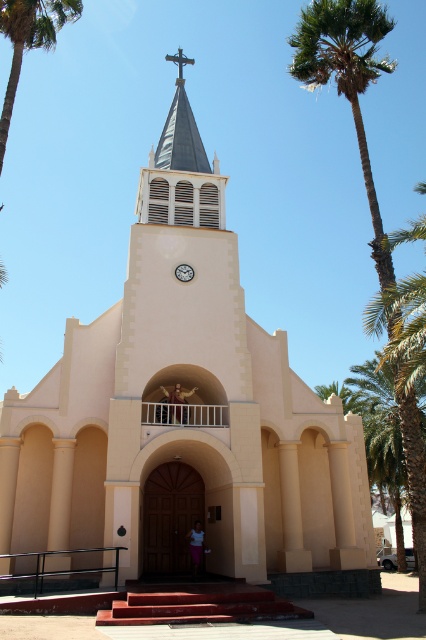
Who is shorter, green leafy palm tree at upper left or smooth beige statue at upper center?

With less height is smooth beige statue at upper center.

Does green leafy palm tree at upper left come behind smooth beige statue at upper center?

No, green leafy palm tree at upper left is in front of smooth beige statue at upper center.

You are a GUI agent. You are given a task and a screenshot of the screen. Output one action in this format:
    pyautogui.click(x=<x>, y=<y>)
    Task: Click on the green leafy palm tree at upper left
    The height and width of the screenshot is (640, 426).
    Given the screenshot: What is the action you would take?
    pyautogui.click(x=29, y=40)

Does smooth beige statue at upper center appear under white fabric person at center?

Incorrect, smooth beige statue at upper center is not positioned below white fabric person at center.

Is smooth beige statue at upper center smaller than white fabric person at center?

Correct, smooth beige statue at upper center occupies less space than white fabric person at center.

Does point (169, 406) come farther from viewer compared to point (196, 522)?

No, it is not.

What are the coordinates of `smooth beige statue at upper center` in the screenshot? It's located at (175, 403).

Does green leafy palm tree at upper left have a larger size compared to white fabric person at center?

Indeed, green leafy palm tree at upper left has a larger size compared to white fabric person at center.

Which is behind, point (17, 26) or point (198, 525)?

The point (198, 525) is behind.

Locate an element on the screen. The image size is (426, 640). green leafy palm tree at upper left is located at coordinates (29, 40).